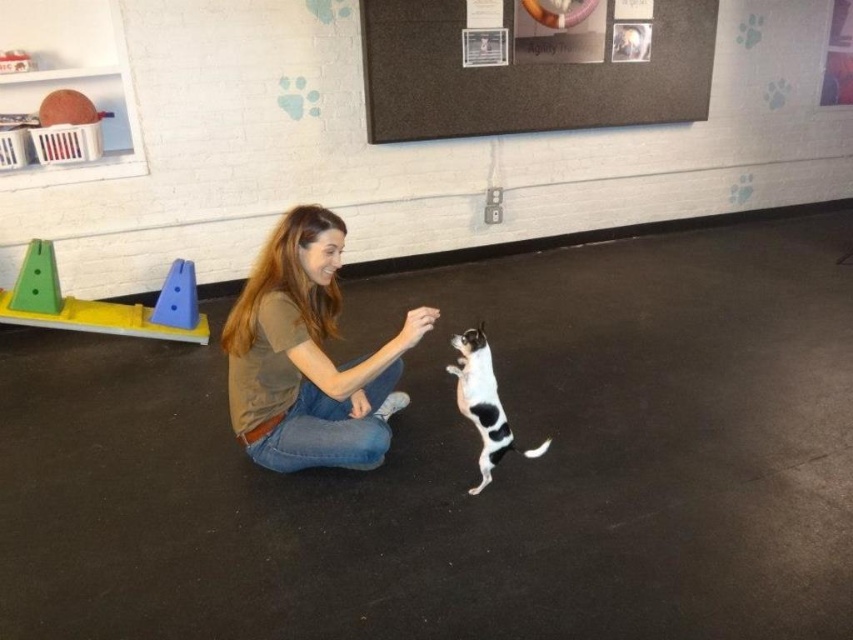
Question: Which point is closer to the camera?

Choices:
 (A) (285, 458)
 (B) (491, 461)
 (C) (22, 305)
 (D) (508, 90)

Answer: (B)

Question: Is smooth plastic cones at left further to camera compared to black and white fur cat at center?

Choices:
 (A) yes
 (B) no

Answer: (A)

Question: Which of the following is the closest to the observer?

Choices:
 (A) smooth plastic cones at left
 (B) brown cotton shirt at center
 (C) dark gray matte bulletin board at upper center

Answer: (B)

Question: Observing the image, what is the correct spatial positioning of dark gray matte bulletin board at upper center in reference to smooth plastic cones at left?

Choices:
 (A) right
 (B) left

Answer: (A)

Question: Estimate the real-world distances between objects in this image. Which object is closer to the smooth plastic cones at left?

Choices:
 (A) black and white fur cat at center
 (B) dark gray matte bulletin board at upper center

Answer: (A)

Question: Does dark gray matte bulletin board at upper center come behind smooth plastic cones at left?

Choices:
 (A) yes
 (B) no

Answer: (A)